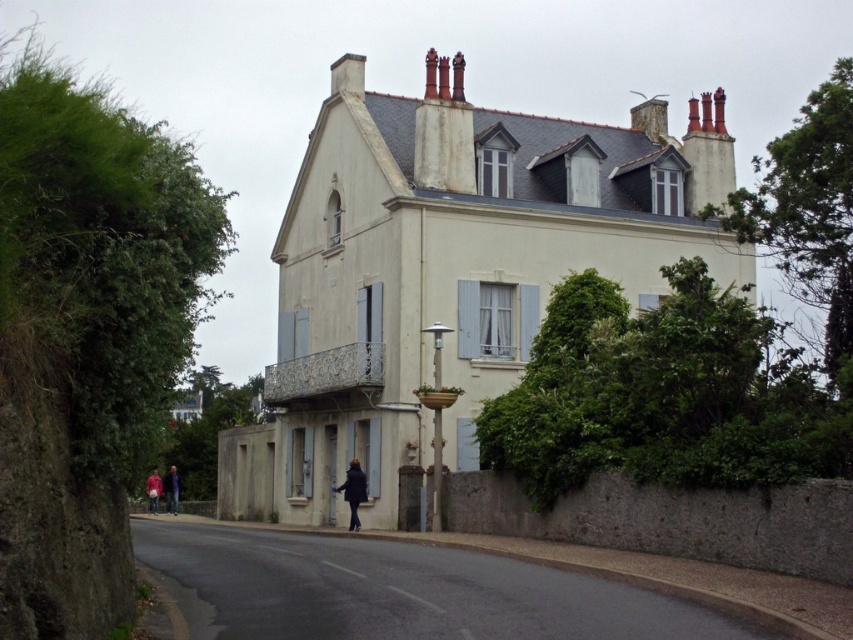
Based on the photo, which is more to the right, blue fabric jacket at lower left or red fabric jacket at lower left?

blue fabric jacket at lower left

Does blue fabric jacket at lower left come in front of red fabric jacket at lower left?

No.

Image resolution: width=853 pixels, height=640 pixels. Find the location of `blue fabric jacket at lower left`. blue fabric jacket at lower left is located at coordinates [171, 490].

The width and height of the screenshot is (853, 640). Identify the location of blue fabric jacket at lower left. (171, 490).

Is black matte coat at lower center to the left of blue fabric jacket at lower left from the viewer's perspective?

No, black matte coat at lower center is not to the left of blue fabric jacket at lower left.

The image size is (853, 640). Identify the location of black matte coat at lower center. (352, 492).

Can you confirm if black matte coat at lower center is positioned above red fabric jacket at lower left?

Yes.

Can you confirm if black matte coat at lower center is positioned below red fabric jacket at lower left?

No.

Where is `black matte coat at lower center`? black matte coat at lower center is located at coordinates (352, 492).